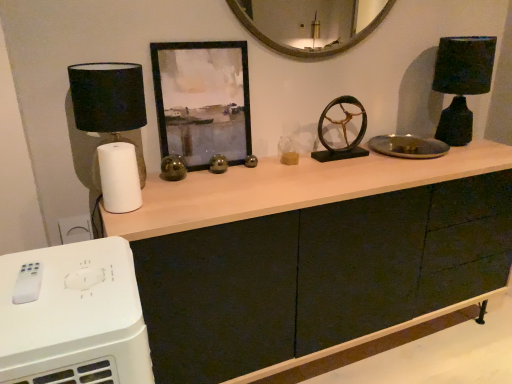
In order to click on free area in between matte black lampshade at left, which is counted as the 1th table lamp, starting from the left, and bronze metallic wheel at center in this screenshot , I will do `click(234, 174)`.